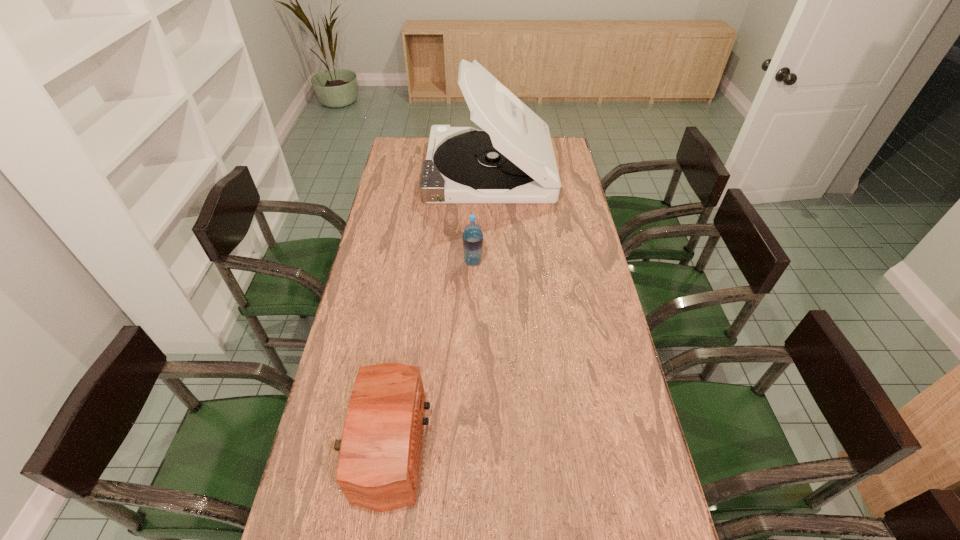
Where is `the farthest object`? The image size is (960, 540). the farthest object is located at coordinates (511, 160).

Where is `CD player`? Image resolution: width=960 pixels, height=540 pixels. CD player is located at coordinates (511, 160).

Find the location of a particular element. The width and height of the screenshot is (960, 540). the second farthest object is located at coordinates (472, 236).

Locate an element on the screen. This screenshot has width=960, height=540. the nearest object is located at coordinates (378, 467).

Find the location of a particular element. The width and height of the screenshot is (960, 540). vacant space located 0.070m on the control panel of the tallest object is located at coordinates (410, 170).

The width and height of the screenshot is (960, 540). In order to click on free region located 0.130m on the control panel of the tallest object in this screenshot , I will do `click(397, 170)`.

Find the location of a particular element. The height and width of the screenshot is (540, 960). vacant space located 0.260m on the right of the second farthest object is located at coordinates (554, 262).

Where is `free region located 0.090m on the front-facing side of the radio receiver`? The image size is (960, 540). free region located 0.090m on the front-facing side of the radio receiver is located at coordinates (464, 447).

Identify the location of object that is positioned at the far edge. (511, 160).

Identify the location of object present at the left edge. Image resolution: width=960 pixels, height=540 pixels. (378, 467).